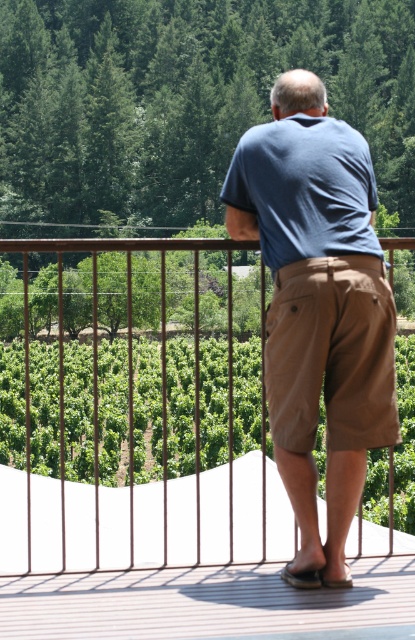
You are standing on the balcony and want to place a small potted plant on the deck. The deck is represented by the point at coordinates (207, 604). Where should you place the plant so it stays on the deck?

Place the plant near the coordinates (207, 604) where the brown textured deck is located to ensure it stays on the deck.

You are standing on the balcony and want to touch the blue cotton shirt at center. Where should you reach to? The coordinates are given as a point in the image. Please provide the coordinates in the format of a point like point (x=317, y=307).

The point (x=317, y=307) marks the location of the blue cotton shirt at center, so you should reach towards point (x=317, y=307).

You are standing on the balcony and want to step onto the deck. Which surface will you step onto first, the brown wood balcony at center or the brown textured deck at center?

You will step onto the brown wood balcony at center first because it is closer to you than the brown textured deck at center.